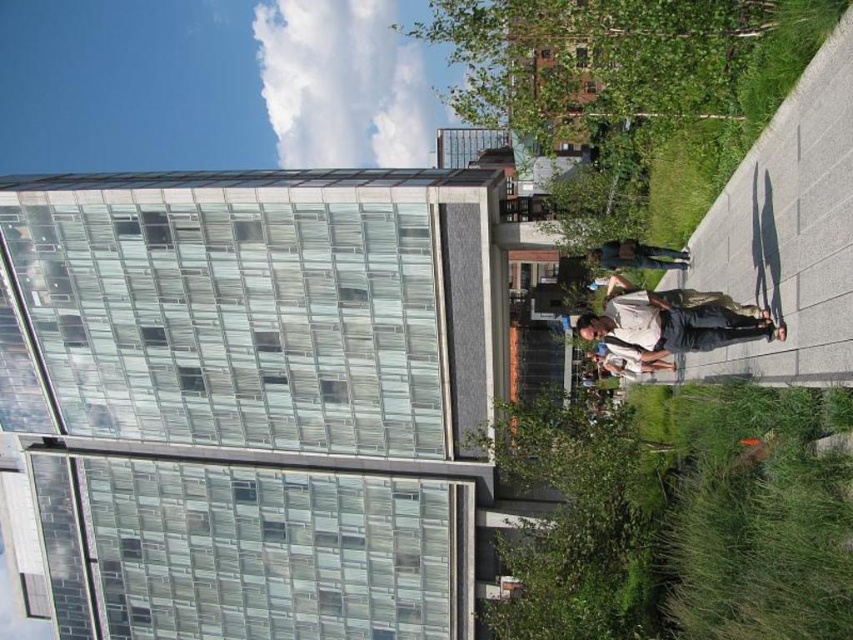
Question: Which object appears closest to the camera in this image?

Choices:
 (A) dark blue jeans at center
 (B) khaki cotton shirt at center
 (C) white cotton shirt at center

Answer: (B)

Question: Does khaki cotton shirt at center lie in front of dark blue jeans at center?

Choices:
 (A) yes
 (B) no

Answer: (A)

Question: Does dark blue jeans at center have a greater width compared to white cotton shirt at center?

Choices:
 (A) yes
 (B) no

Answer: (A)

Question: Which point appears farthest from the camera in this image?

Choices:
 (A) (619, 285)
 (B) (653, 259)

Answer: (B)

Question: Can you confirm if khaki cotton shirt at center is positioned to the left of white cotton shirt at center?

Choices:
 (A) no
 (B) yes

Answer: (A)

Question: Which of the following is the closest to the observer?

Choices:
 (A) click(x=717, y=292)
 (B) click(x=590, y=256)

Answer: (A)